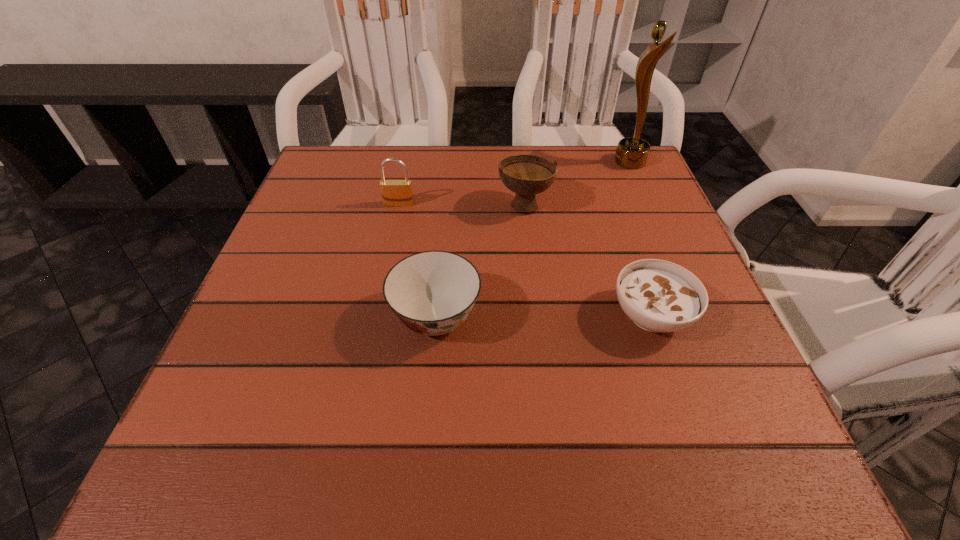
The height and width of the screenshot is (540, 960). Find the location of `vacant space located 0.310m on the front-facing side of the tallest object`. vacant space located 0.310m on the front-facing side of the tallest object is located at coordinates (492, 162).

This screenshot has width=960, height=540. I want to click on free space located on the front-facing side of the tallest object, so click(492, 162).

Where is `vacant area situated on the front-facing side of the padlock`? Image resolution: width=960 pixels, height=540 pixels. vacant area situated on the front-facing side of the padlock is located at coordinates (374, 320).

I want to click on free region located on the back of the second soup bowl from left to right, so pos(521,172).

The image size is (960, 540). In order to click on vacant space located 0.080m on the back of the leftmost soup bowl in this screenshot , I will do `click(442, 255)`.

I want to click on free space located 0.400m on the left of the rightmost soup bowl, so click(x=379, y=315).

Where is `award that is at the far edge`? The height and width of the screenshot is (540, 960). award that is at the far edge is located at coordinates (632, 152).

Where is `soup bowl that is positioned at the far edge`? soup bowl that is positioned at the far edge is located at coordinates (526, 175).

I want to click on award that is positioned at the right edge, so click(x=632, y=152).

Where is `soup bowl positioned at the right edge`? soup bowl positioned at the right edge is located at coordinates (658, 296).